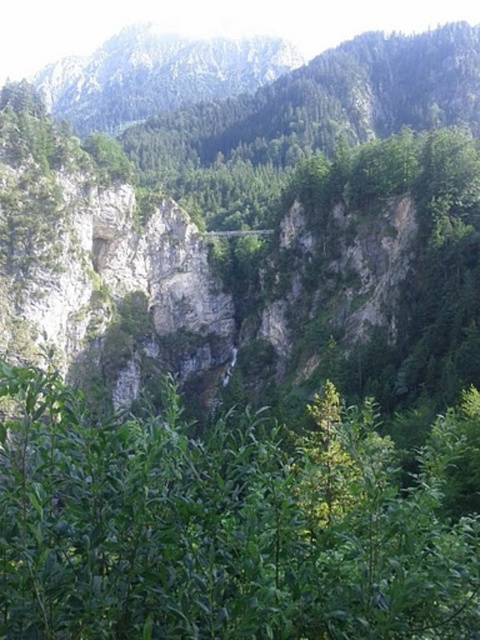
Question: Does green leafy tree at center appear on the left side of rocky mountain at upper center?

Choices:
 (A) yes
 (B) no

Answer: (B)

Question: Which of the following is the closest to the observer?

Choices:
 (A) green leafy tree at center
 (B) rocky mountain at upper center

Answer: (A)

Question: Is green leafy tree at center in front of rocky mountain at upper center?

Choices:
 (A) no
 (B) yes

Answer: (B)

Question: Which of the following is the closest to the observer?

Choices:
 (A) (340, 429)
 (B) (135, 122)

Answer: (A)

Question: Is green leafy tree at center to the right of rocky mountain at upper center from the viewer's perspective?

Choices:
 (A) no
 (B) yes

Answer: (B)